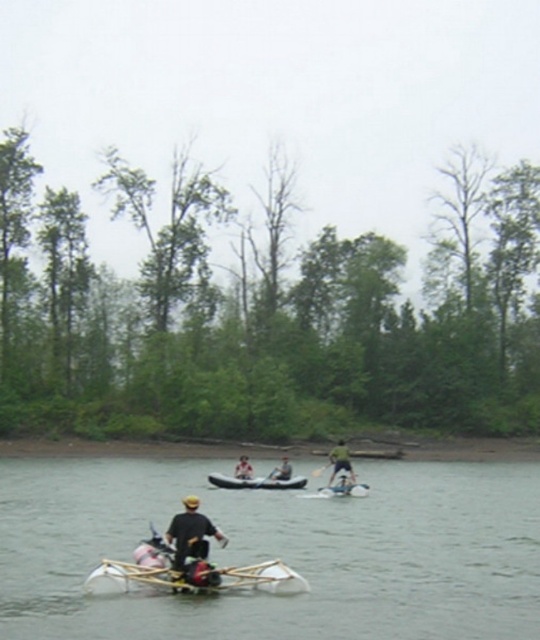
Question: Estimate the real-world distances between objects in this image. Which object is farther from the white plastic raft at lower center?

Choices:
 (A) green fabric kayak at center
 (B) white rubber canoe at center
 (C) green matte kayak at center
 (D) dark brown leather hat at center

Answer: (C)

Question: Is green matte kayak at center closer to the viewer compared to matte black canoe at center?

Choices:
 (A) yes
 (B) no

Answer: (A)

Question: Does white rubber canoe at center have a lesser width compared to green fabric kayak at center?

Choices:
 (A) yes
 (B) no

Answer: (B)

Question: Which point is farther to the camera?

Choices:
 (A) (239, 465)
 (B) (228, 477)
 (C) (14, 566)
 (D) (333, 490)

Answer: (B)

Question: Among these objects, which one is farthest from the camera?

Choices:
 (A) white rubber canoe at center
 (B) white fabric kayak at center
 (C) white plastic raft at lower center

Answer: (A)

Question: Can you confirm if white rubber canoe at center is positioned to the left of green fabric kayak at center?

Choices:
 (A) yes
 (B) no

Answer: (A)